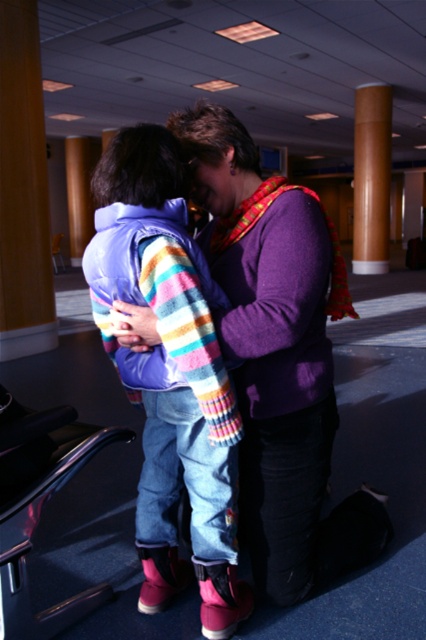
You are standing in the airport and see the purple soft sweater at center and the metallic black chair at lower left. Which object is closer to your right side?

The purple soft sweater at center is to the right of the metallic black chair at lower left, so it is closer to your right side.

You are an interior designer assessing the space for accessibility. The rainbow striped sweater at center and the metallic black chair at lower left are both in the room. Which object is taller, and how does this affect wheelchair access near them?

The rainbow striped sweater at center is much taller than the metallic black chair at lower left. This means the taller rainbow striped sweater at center may pose a clearance issue for wheelchair users navigating the area, as they need to ensure sufficient vertical space to pass without obstruction.